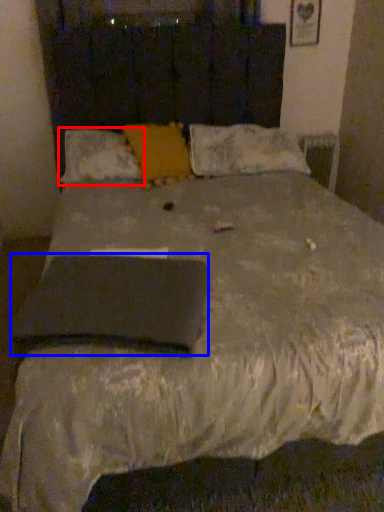
Question: Which object appears farthest to the camera in this image, pillow (highlighted by a red box) or pad (highlighted by a blue box)?

Choices:
 (A) pillow
 (B) pad

Answer: (A)